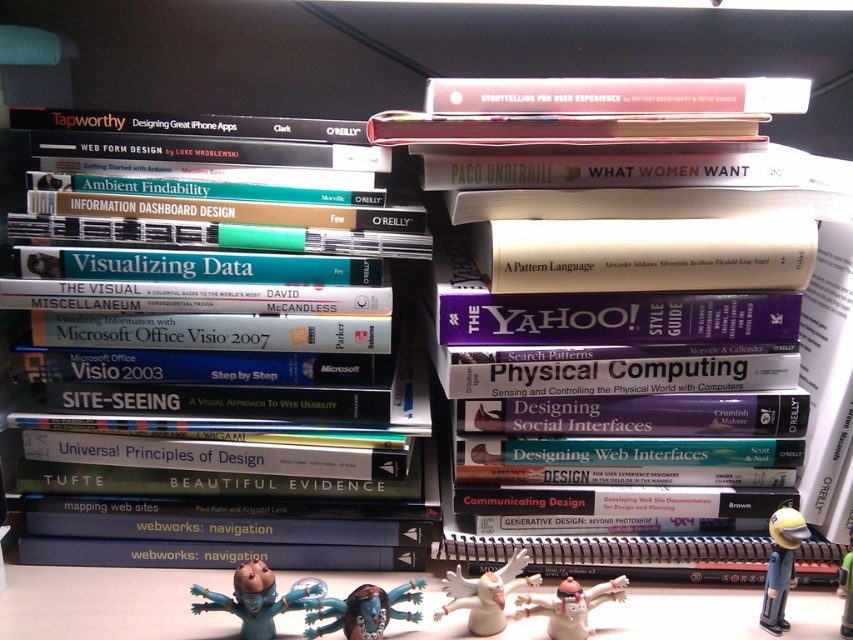
Question: Which object is the closest to the hardcover book at upper center?

Choices:
 (A) teal matte figurine at lower center
 (B) green rubber toy at lower right
 (C) matte pink book at upper center
 (D) hardcover book at upper left

Answer: (C)

Question: Does teal matte figurine at lower center have a smaller size compared to white matte angel at center?

Choices:
 (A) yes
 (B) no

Answer: (B)

Question: Which object is closer to the camera taking this photo?

Choices:
 (A) white matte angel at center
 (B) green rubber toy at lower right
 (C) yellow matte baseball bat at lower right

Answer: (A)

Question: Among these points, which one is nearest to the camera?

Choices:
 (A) (764, 90)
 (B) (299, 605)
 (C) (639, 224)
 (D) (308, 602)

Answer: (D)

Question: Does yellow matte baseball bat at lower right appear on the right side of green rubber toy at lower right?

Choices:
 (A) no
 (B) yes

Answer: (A)

Question: Is hardcover book at upper center thinner than yellow matte baseball bat at lower right?

Choices:
 (A) yes
 (B) no

Answer: (B)